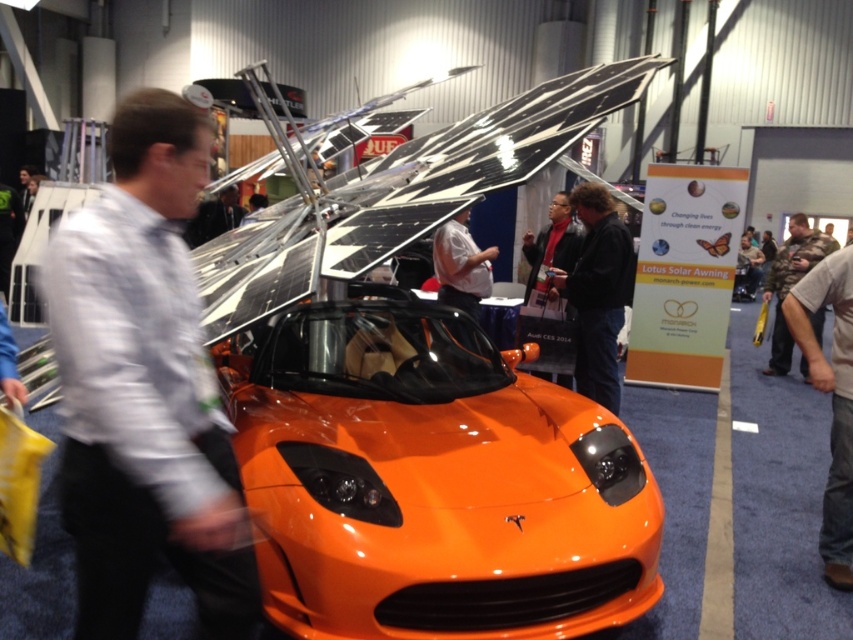
You are a photographer at the exhibition. You need to capture both the glossy orange sports car at center and the brown denim pants at lower right in a single frame. Considering their sizes, which object should you position closer to the camera to ensure both are visible clearly?

Since the glossy orange sports car at center is larger than the brown denim pants at lower right, you should position the glossy orange sports car at center farther away from the camera and the brown denim pants at lower right closer to the camera. This way, both objects will appear balanced in size within the frame.

You are at a trade show and want to take a photo of the glossy orange sports car at center and the white shirt at left. Which object is closer to the left side of the image?

The white shirt at left is closer to the left side of the image because the glossy orange sports car at center is positioned on the right side of white shirt at left.

You are a photographer at the exhibition and want to capture both the glossy orange sports car at center and the dark brown leather jacket at center in a single frame. Given that your camera has a fixed focal length, which object should you position closer to the camera to ensure both fit in the frame?

Since the glossy orange sports car at center is wider than the dark brown leather jacket at center, you should position the glossy orange sports car at center closer to the camera. This will make it appear smaller in the frame, allowing both objects to fit within the camera view.